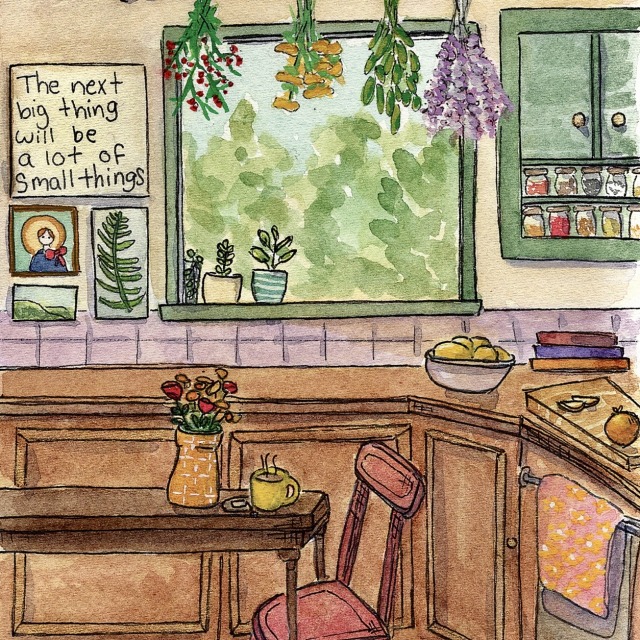
At what (x,y) coordinates should I click in order to perform the action: click on cabinets. Please return your answer as a coordinate pair (x, y). Image resolution: width=640 pixels, height=640 pixels. Looking at the image, I should click on (479, 527), (335, 464), (136, 466).